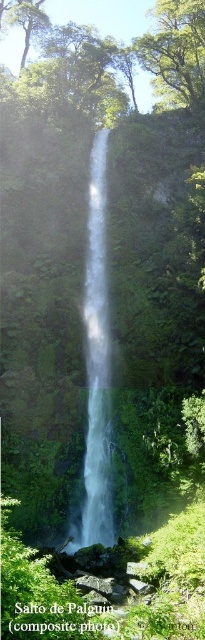
Question: Does clear glass waterfall at center appear on the left side of green leafy tree at upper center?

Choices:
 (A) no
 (B) yes

Answer: (B)

Question: Is clear glass waterfall at center thinner than green leafy tree at upper center?

Choices:
 (A) yes
 (B) no

Answer: (A)

Question: Which point is closer to the camera taking this photo?

Choices:
 (A) (x=175, y=38)
 (B) (x=97, y=456)

Answer: (B)

Question: Which point is farther to the camera?

Choices:
 (A) (93, 474)
 (B) (177, 22)

Answer: (B)

Question: Is clear glass waterfall at center bigger than green leafy tree at upper center?

Choices:
 (A) yes
 (B) no

Answer: (B)